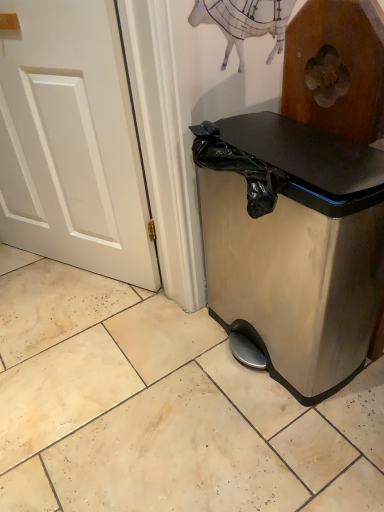
At what (x,y) coordinates should I click in order to perform the action: click on blank area to the left of satin silver trash can at lower right. Please return your answer as a coordinate pair (x, y). The image size is (384, 512). Looking at the image, I should click on click(x=161, y=386).